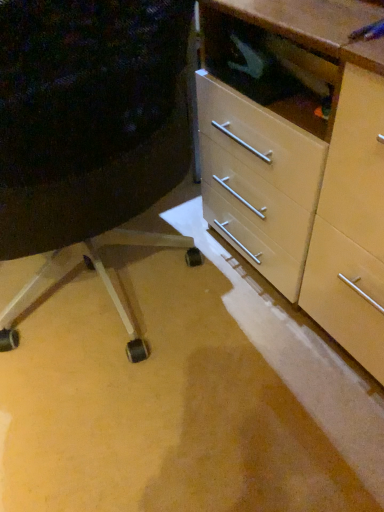
This screenshot has width=384, height=512. What are the coordinates of `matte plastic drawer at center-right` in the screenshot? It's located at (88, 134).

This screenshot has width=384, height=512. What do you see at coordinates (88, 134) in the screenshot?
I see `matte plastic drawer at center-right` at bounding box center [88, 134].

Find the location of a particular element. matte wood chest of drawers at center is located at coordinates pos(299,157).

Image resolution: width=384 pixels, height=512 pixels. What do you see at coordinates (299, 157) in the screenshot?
I see `matte wood chest of drawers at center` at bounding box center [299, 157].

What are the coordinates of `matte plastic drawer at center-right` in the screenshot? It's located at (88, 134).

Between matte plastic drawer at center-right and matte wood chest of drawers at center, which one appears on the right side from the viewer's perspective?

matte wood chest of drawers at center.

Is matte plastic drawer at center-right in front of matte wood chest of drawers at center?

Yes, matte plastic drawer at center-right is closer to the viewer.

Is point (75, 100) positioned in front of point (289, 79)?

Yes.

From the image's perspective, between matte plastic drawer at center-right and matte wood chest of drawers at center, which one is located above?

matte wood chest of drawers at center, from the image's perspective.

From a real-world perspective, is matte plastic drawer at center-right located beneath matte wood chest of drawers at center?

No, from a real-world perspective, matte plastic drawer at center-right is not below matte wood chest of drawers at center.

Considering the relative sizes of matte plastic drawer at center-right and matte wood chest of drawers at center in the image provided, is matte plastic drawer at center-right wider than matte wood chest of drawers at center?

Indeed, matte plastic drawer at center-right has a greater width compared to matte wood chest of drawers at center.

Based on the photo, which of these two, matte plastic drawer at center-right or matte wood chest of drawers at center, stands taller?

matte plastic drawer at center-right.

Which of these two, matte plastic drawer at center-right or matte wood chest of drawers at center, is smaller?

matte wood chest of drawers at center.

Which is correct: matte plastic drawer at center-right is inside matte wood chest of drawers at center, or outside of it?

matte plastic drawer at center-right is located beyond the bounds of matte wood chest of drawers at center.

Is matte plastic drawer at center-right next to matte wood chest of drawers at center?

matte plastic drawer at center-right and matte wood chest of drawers at center are not in contact.

In the scene shown: Is matte plastic drawer at center-right facing away from matte wood chest of drawers at center?

No, matte wood chest of drawers at center is not at the back of matte plastic drawer at center-right.

Identify the location of the chest of drawers located above the matte plastic drawer at center-right (from the image's perspective). The height and width of the screenshot is (512, 384). (299, 157).

Is matte wood chest of drawers at center to the left of matte plastic drawer at center-right from the viewer's perspective?

No.

Which object is closer to the camera, matte wood chest of drawers at center or matte plastic drawer at center-right?

Positioned in front is matte plastic drawer at center-right.

Between point (234, 246) and point (92, 51), which one is positioned in front?

The point (92, 51) is more forward.

In the scene shown: From the image's perspective, is matte wood chest of drawers at center on matte plastic drawer at center-right?

Indeed, from the image's perspective, matte wood chest of drawers at center is shown above matte plastic drawer at center-right.

From a real-world perspective, does matte wood chest of drawers at center stand above matte plastic drawer at center-right?

Actually, matte wood chest of drawers at center is physically below matte plastic drawer at center-right in the real world.

Can you confirm if matte wood chest of drawers at center is thinner than matte plastic drawer at center-right?

Indeed, matte wood chest of drawers at center has a lesser width compared to matte plastic drawer at center-right.

Does matte wood chest of drawers at center have a lesser height compared to matte plastic drawer at center-right?

Indeed, matte wood chest of drawers at center has a lesser height compared to matte plastic drawer at center-right.

Considering the relative sizes of matte wood chest of drawers at center and matte plastic drawer at center-right in the image provided, is matte wood chest of drawers at center bigger than matte plastic drawer at center-right?

Incorrect, matte wood chest of drawers at center is not larger than matte plastic drawer at center-right.

Is matte plastic drawer at center-right surrounded by matte wood chest of drawers at center?

No.

Are matte wood chest of drawers at center and matte plastic drawer at center-right making contact?

No, matte wood chest of drawers at center is not with matte plastic drawer at center-right.

Is matte plastic drawer at center-right at the back of matte wood chest of drawers at center?

No, matte wood chest of drawers at center's orientation is not away from matte plastic drawer at center-right.

Locate an element on the screen. This screenshot has height=512, width=384. chest of drawers behind the matte plastic drawer at center-right is located at coordinates (299, 157).

At what (x,y) coordinates should I click in order to perform the action: click on furniture below the matte wood chest of drawers at center (from the image's perspective). Please return your answer as a coordinate pair (x, y). The image size is (384, 512). Looking at the image, I should click on (88, 134).

Identify the location of chest of drawers above the matte plastic drawer at center-right (from the image's perspective). This screenshot has height=512, width=384. (299, 157).